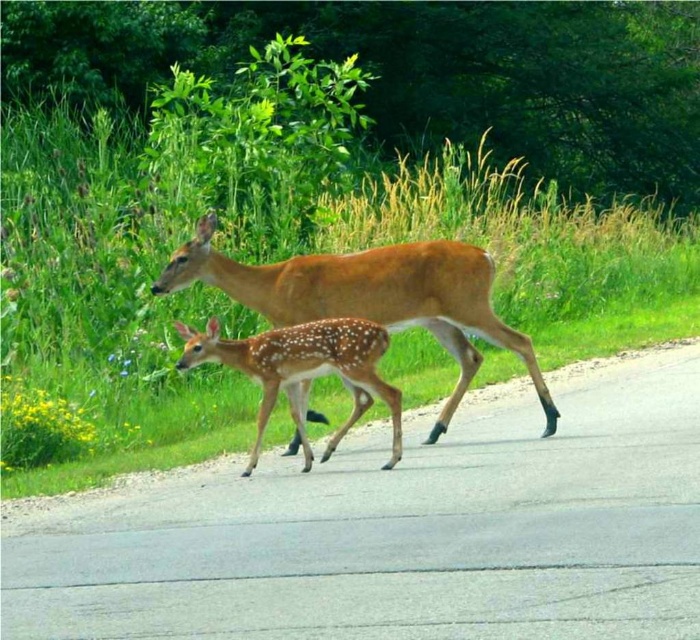
You are a driver approaching a road with two deer crossing. The adult deer is ahead, and the fawn is beside it. You see a point marked at coordinates (371, 296). Which deer does this point correspond to?

The point at coordinates (371, 296) corresponds to the brown speckled deer at center.